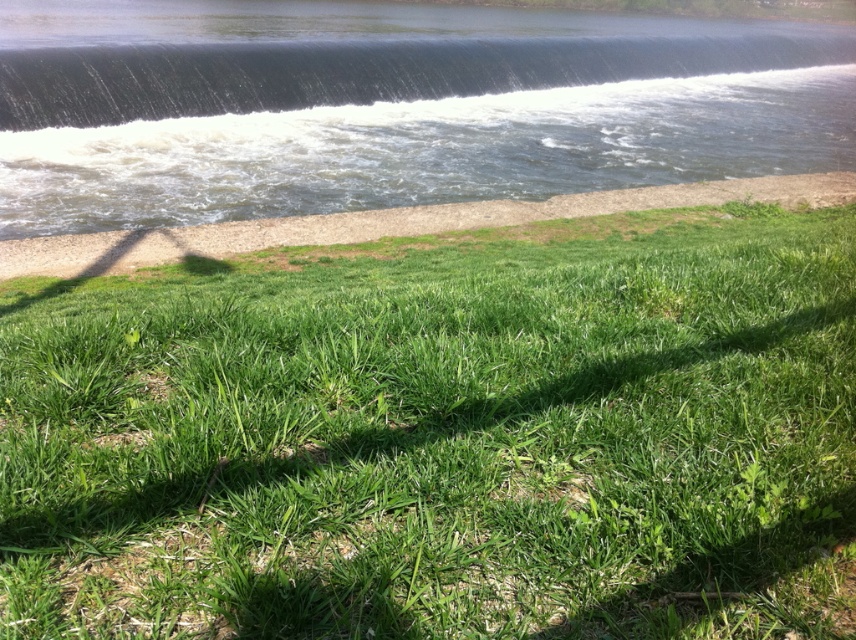
Question: Is the position of green grassy at upper center less distant than that of dark blue water at upper center?

Choices:
 (A) no
 (B) yes

Answer: (B)

Question: Does green grassy at upper center have a smaller size compared to dark blue water at upper center?

Choices:
 (A) no
 (B) yes

Answer: (B)

Question: Can you confirm if green grassy at upper center is bigger than dark blue water at upper center?

Choices:
 (A) yes
 (B) no

Answer: (B)

Question: Which object is farther from the camera taking this photo?

Choices:
 (A) green grassy at upper center
 (B) dark blue water at upper center

Answer: (B)

Question: Which point is farther to the camera?

Choices:
 (A) green grassy at upper center
 (B) dark blue water at upper center

Answer: (B)